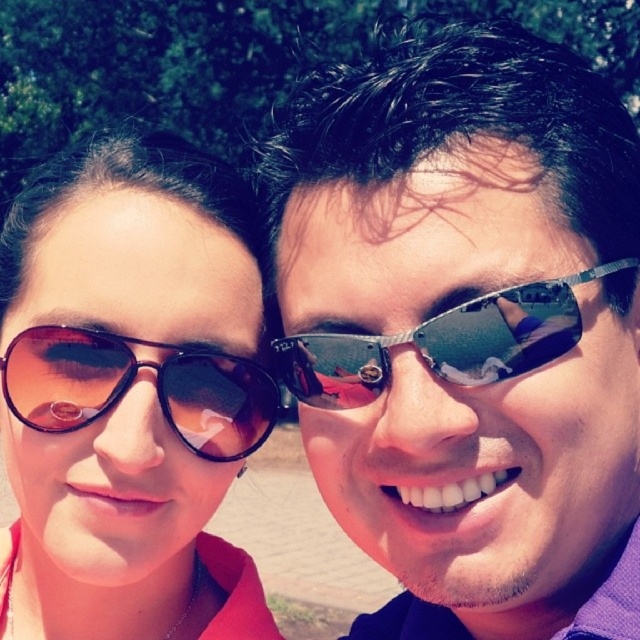
You are a photographer trying to capture a closeup shot of the matte black goggles at left and the shiny metallic sunglasses at center. Which object should you focus on first if you want to ensure both are in focus without adjusting the camera settings?

The matte black goggles at left is positioned under the shiny metallic sunglasses at center, so focusing on the shiny metallic sunglasses at center first will ensure both are in focus because it is closer to the camera.

You are trying to decide which item to take with you for a hike. You have the matte black sunglasses at left and the matte black goggles at left. Based on their size, which one can you easily fit into your small pocket?

The matte black goggles at left are narrower than the matte black sunglasses at left, so the matte black goggles at left can be easily fit into your small pocket.

You are an optometrist examining two pairs of eyewear worn by the person on the left. The matte black sunglasses at left and the matte black goggles at left. Which one is closer to the person on the left?

The matte black sunglasses at left is closer to the person on the left because it is in front of the matte black goggles at left.